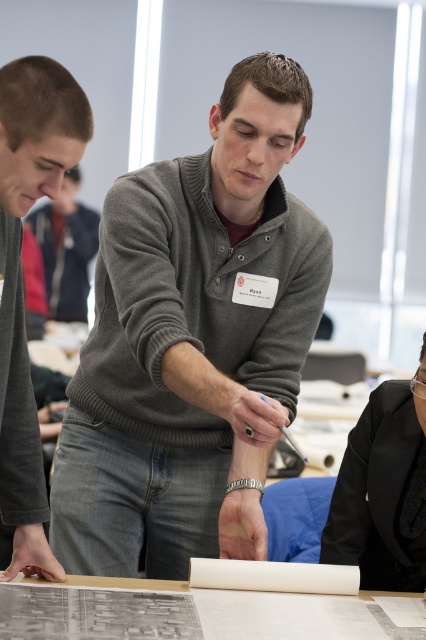
Looking at this image, is gray sweater at center behind brown hair at left?

Yes, it is.

I want to click on gray sweater at center, so click(x=193, y=342).

Which is below, white paper at center or matte gray sweater at center?

white paper at center is below.

This screenshot has width=426, height=640. I want to click on white paper at center, so click(x=183, y=612).

Is gray sweater at center further to camera compared to black satin blazer at lower right?

No.

Which of these two, gray sweater at center or black satin blazer at lower right, stands taller?

Standing taller between the two is gray sweater at center.

Who is more distant from viewer, (275, 170) or (406, 483)?

Positioned behind is point (406, 483).

In order to click on gray sweater at center in this screenshot , I will do `click(193, 342)`.